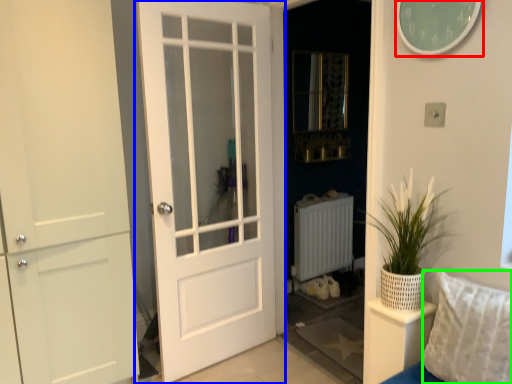
Question: Based on their relative distances, which object is nearer to clock (highlighted by a red box)? Choose from door (highlighted by a blue box) and pillow (highlighted by a green box).

Choices:
 (A) door
 (B) pillow

Answer: (B)